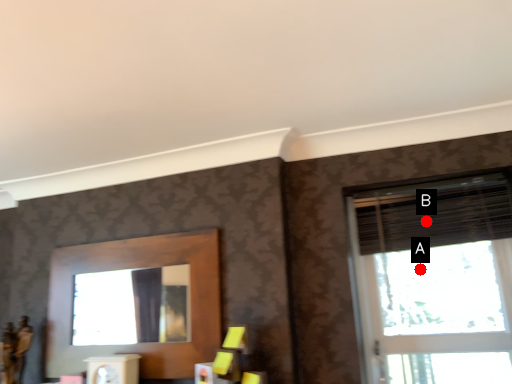
Question: Two points are circled on the image, labeled by A and B beside each circle. Among these points, which one is farthest from the camera?

Choices:
 (A) A is further
 (B) B is further

Answer: (A)